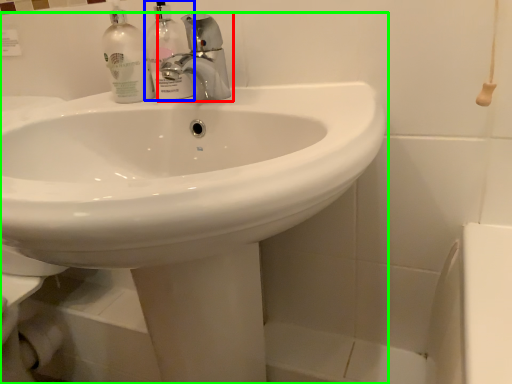
Question: Estimate the real-world distances between objects in this image. Which object is farther from tap (highlighted by a red box), cleaning product (highlighted by a blue box) or sink (highlighted by a green box)?

Choices:
 (A) cleaning product
 (B) sink

Answer: (B)